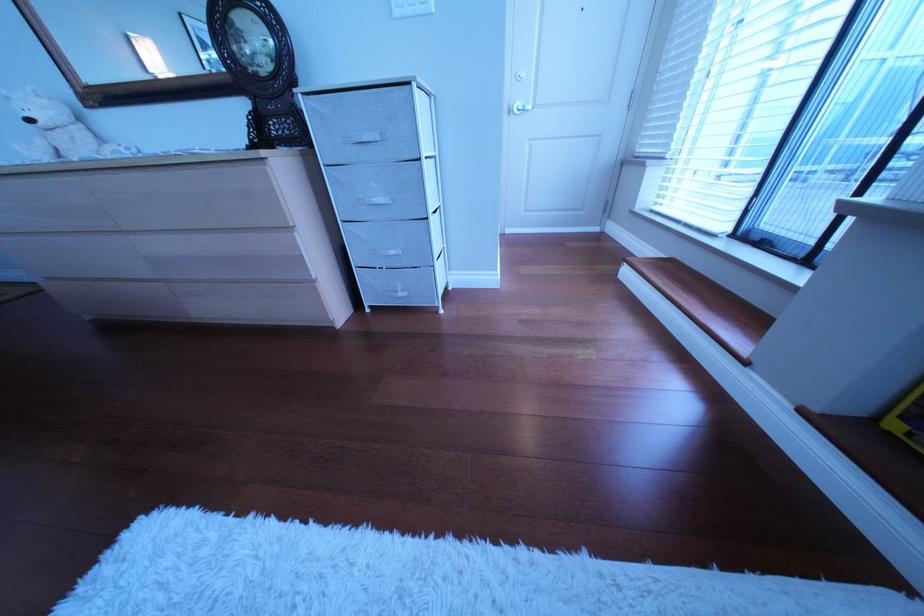
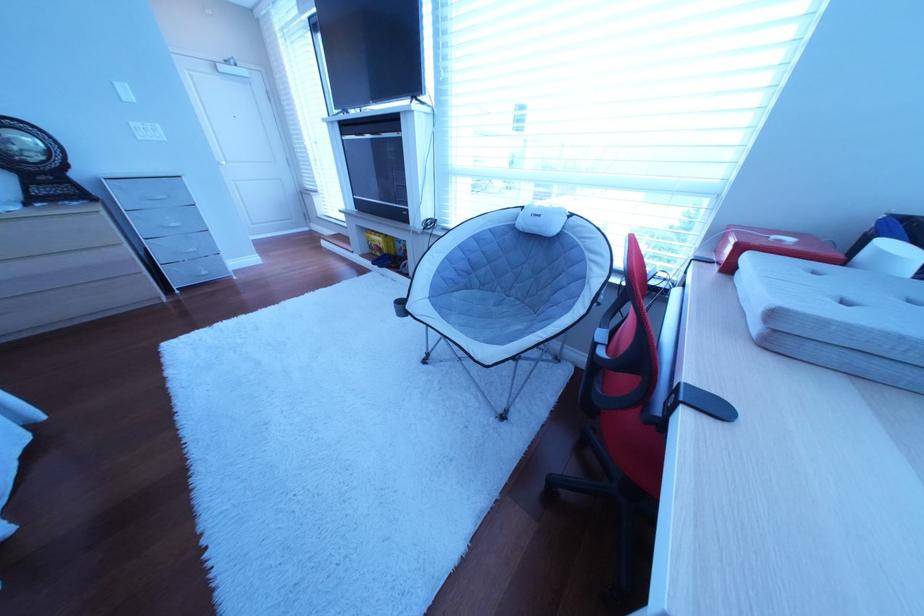
Question: I am providing you with two images of the same scene from different viewpoints. After the viewpoint changes to image2, which objects are now occluded?

Choices:
 (A) fabric drawer handle
 (B) red plastic box
 (C) folded grey cushion
 (D) none of these

Answer: (D)